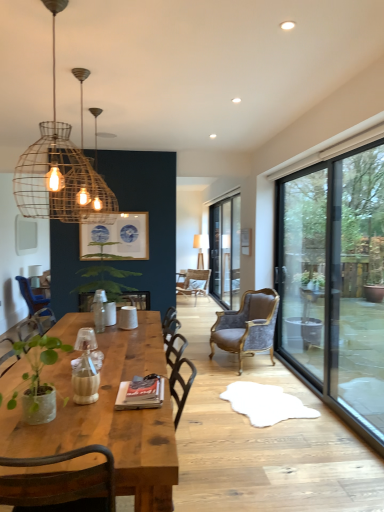
Locate an element on the screen. free spot in front of green matte plant at lower left, the first houseplant from the front is located at coordinates (31, 444).